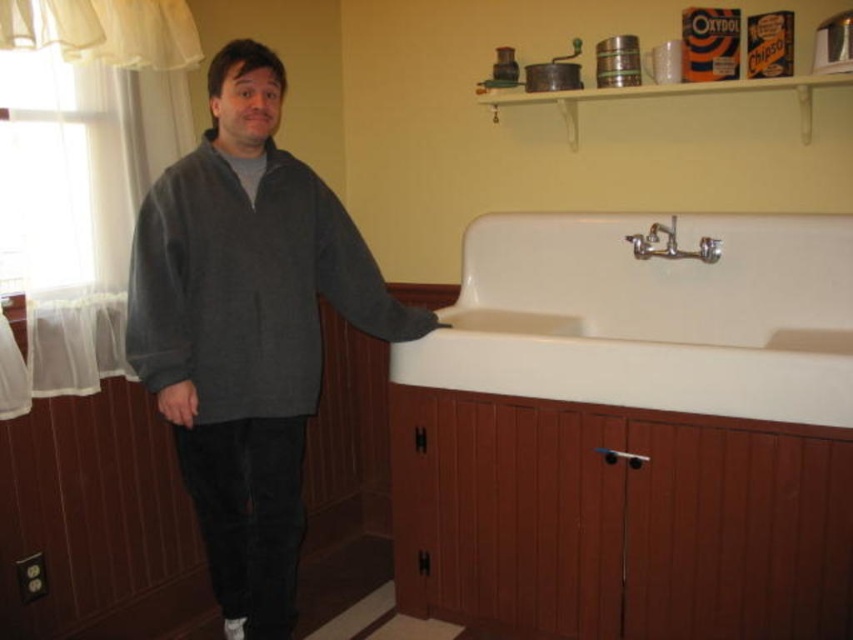
You are a person trying to reach the silver metallic faucet at upper center to turn on the water. There is a gray fleece jacket at center in the way. Can you move the jacket to access the faucet?

The gray fleece jacket at center is positioned under the silver metallic faucet at upper center, so you can move the jacket to access the faucet since it is below it.

You are a delivery person who needs to place a package that is 1.5 meters long between the silver metallic faucet at upper center and the matte gray sweater at lower left. Can you fit the package between them without bending it?

The distance between the silver metallic faucet at upper center and the matte gray sweater at lower left is 1.39 meters, which is shorter than the 1.5 meters length of the package. Therefore, the package cannot be placed between them without bending it.

You are standing in the bathroom and see two points on the wall. The first point is at position point (672, 227) and the second point is at position point (158, 406). If you were to draw a straight line between them, would the line pass in front of or behind the sink?

The line between point (672, 227) and point (158, 406) would pass behind the sink because point (672, 227) is behind point (158, 406).